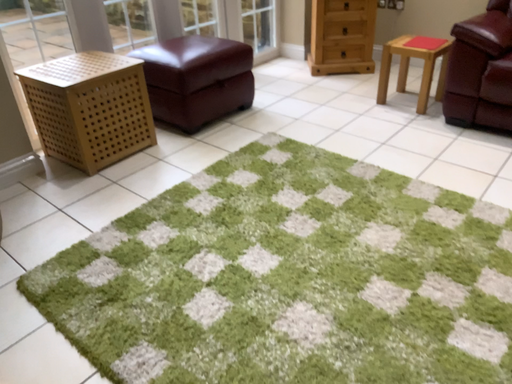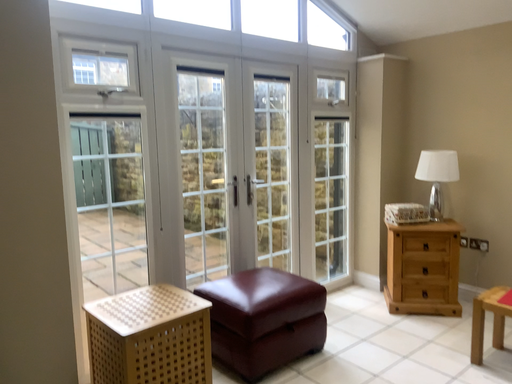
Question: Which way did the camera rotate in the video?

Choices:
 (A) rotated upward
 (B) rotated downward

Answer: (A)